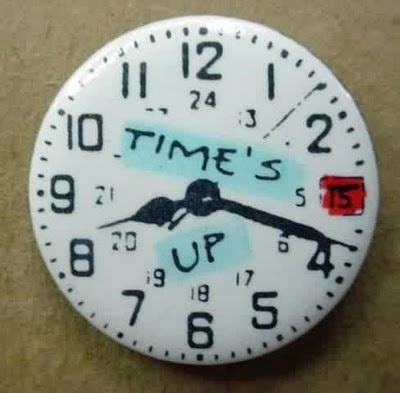
Identify the location of clock. (192, 175).